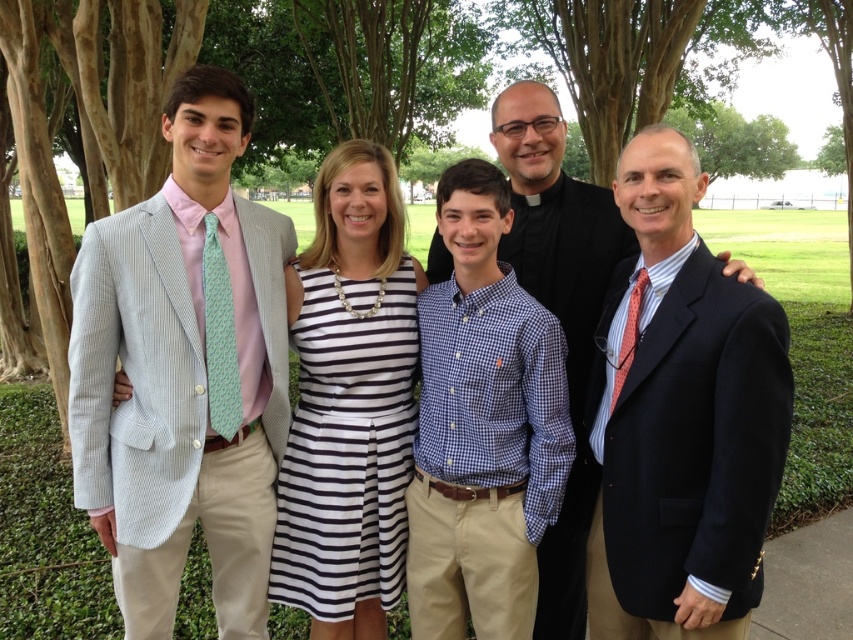
Question: Considering the relative positions of blue checkered shirt at center and black and white striped dress at center in the image provided, where is blue checkered shirt at center located with respect to black and white striped dress at center?

Choices:
 (A) right
 (B) left

Answer: (A)

Question: Which point is farther to the camera?

Choices:
 (A) matte black suit at center
 (B) dark blue suit at center
 (C) black and white striped dress at center
 (D) light gray seersucker suit at left

Answer: (C)

Question: Is black and white striped dress at center wider than matte black suit at center?

Choices:
 (A) no
 (B) yes

Answer: (B)

Question: Which point appears closest to the camera in this image?

Choices:
 (A) (608, 252)
 (B) (735, 509)

Answer: (B)

Question: Can you confirm if dark blue suit at center is bigger than blue checkered shirt at center?

Choices:
 (A) yes
 (B) no

Answer: (A)

Question: Which of these objects is positioned closest to the dark blue suit at center?

Choices:
 (A) light gray seersucker suit at left
 (B) blue checkered shirt at center
 (C) black and white striped dress at center
 (D) matte black suit at center

Answer: (B)